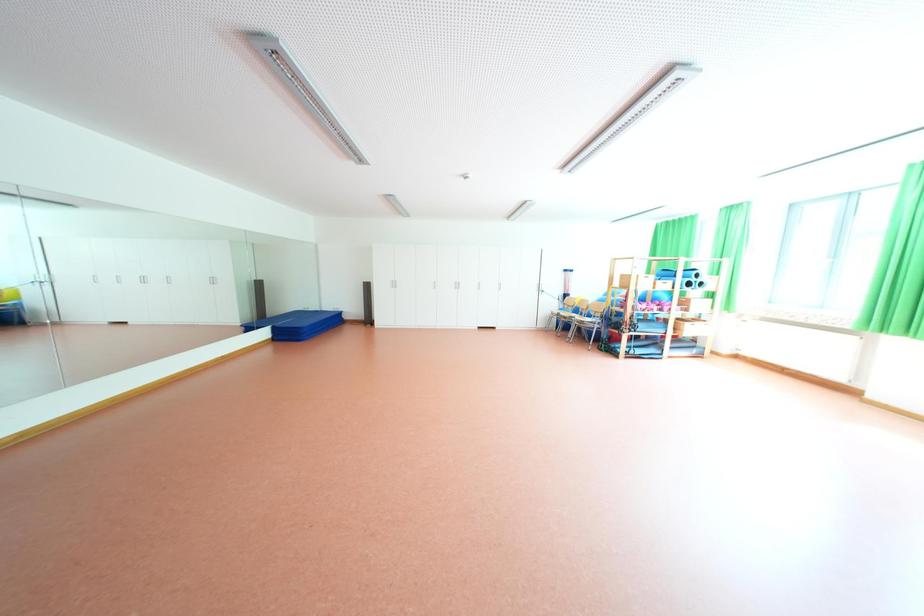
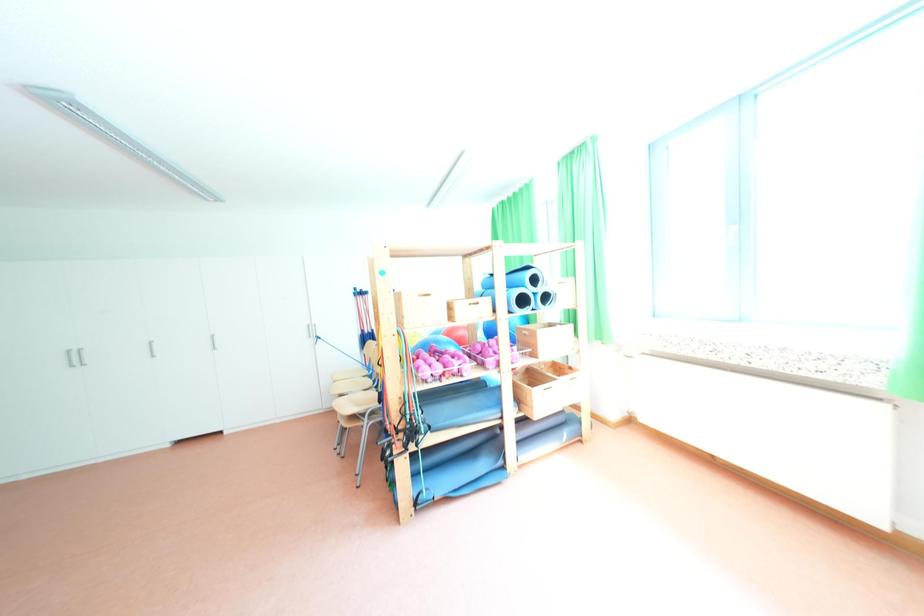
In a continuous first-person perspective shot, in which direction is the camera moving?

The movement direction of the cameraman is right, forward.